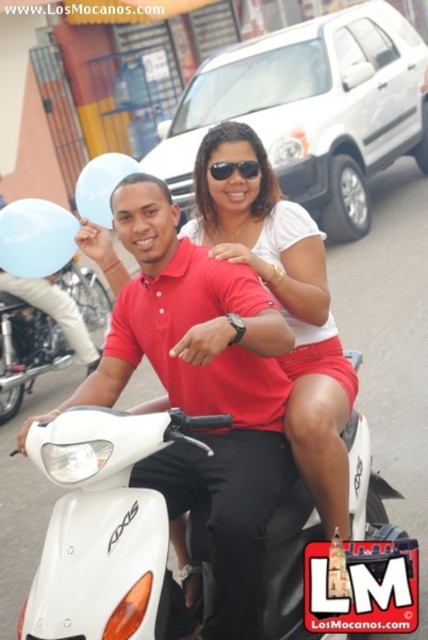
You are a photographer trying to capture a closeup of the black plastic sunglasses at center. However, there is a light blue rubber balloon at upper left in the way. Can you determine if the balloon is closer to the camera than the sunglasses?

The light blue rubber balloon at upper left is larger in size than the black plastic sunglasses at center. Since larger objects in a photo are typically closer to the camera, the balloon is likely closer to the camera than the sunglasses.

What is the exact coordinate of the white matte skirt at center?

The white matte skirt at center is located at point (285, 305).

You are standing in the street and see the white matte skirt at center. If you want to reach it in 3 seconds, what is the minimum speed you need to move towards it?

To reach the white matte skirt at center located 2.55 meters away in 3 seconds, you would need to move at a minimum speed of approximately 0.85 meters per second.